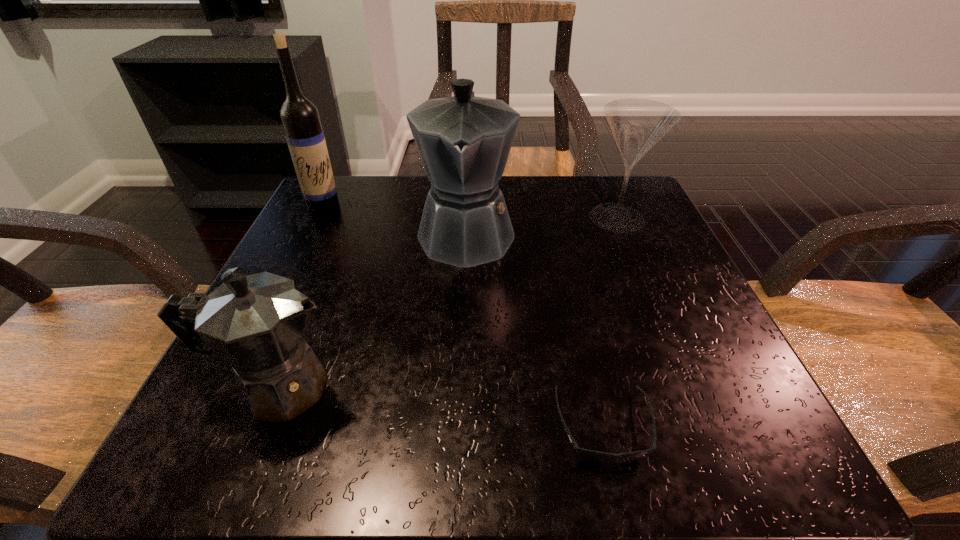
Where is `wine bottle`? The image size is (960, 540). wine bottle is located at coordinates (300, 118).

Identify the location of the farther coffeepot. (464, 141).

Locate an element on the screen. The width and height of the screenshot is (960, 540). the third object from left to right is located at coordinates (464, 141).

Locate an element on the screen. The width and height of the screenshot is (960, 540). flute glass is located at coordinates (637, 125).

What are the coordinates of `the left coffeepot` in the screenshot? It's located at (255, 324).

In order to click on the nearer coffeepot in this screenshot , I will do `click(255, 324)`.

The height and width of the screenshot is (540, 960). I want to click on the shortest object, so click(x=595, y=456).

This screenshot has height=540, width=960. I want to click on sunglasses, so click(x=595, y=456).

Image resolution: width=960 pixels, height=540 pixels. Find the location of `blank space located 0.090m on the label of the wine bottle`. blank space located 0.090m on the label of the wine bottle is located at coordinates (307, 242).

Locate an element on the screen. The width and height of the screenshot is (960, 540). vacant space situated 0.310m at the spout of the taller coffeepot is located at coordinates (458, 442).